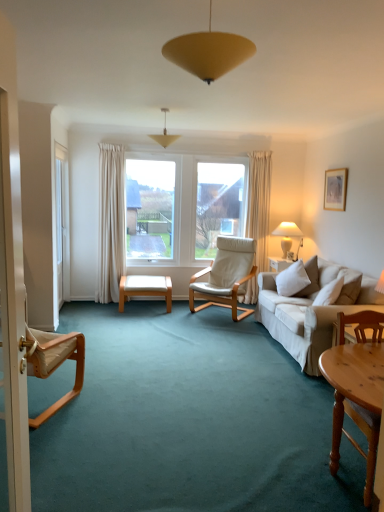
Where is `vacant space underneath matte yellow cone at center, which appears as the 1th lamp when viewed from the left (from a real-world perspective)`? The image size is (384, 512). vacant space underneath matte yellow cone at center, which appears as the 1th lamp when viewed from the left (from a real-world perspective) is located at coordinates (170, 329).